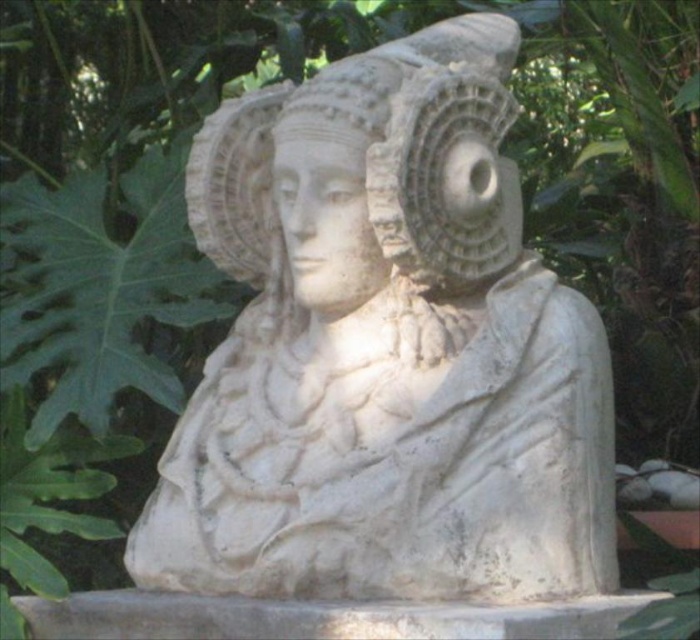
Question: Is white marble bust at center behind white stone bust at center?

Choices:
 (A) yes
 (B) no

Answer: (B)

Question: Which object appears farthest from the camera in this image?

Choices:
 (A) white stone bust at center
 (B) white marble bust at center

Answer: (A)

Question: Where is white marble bust at center located in relation to white stone bust at center in the image?

Choices:
 (A) right
 (B) left

Answer: (A)

Question: Is white marble bust at center thinner than white stone bust at center?

Choices:
 (A) no
 (B) yes

Answer: (A)